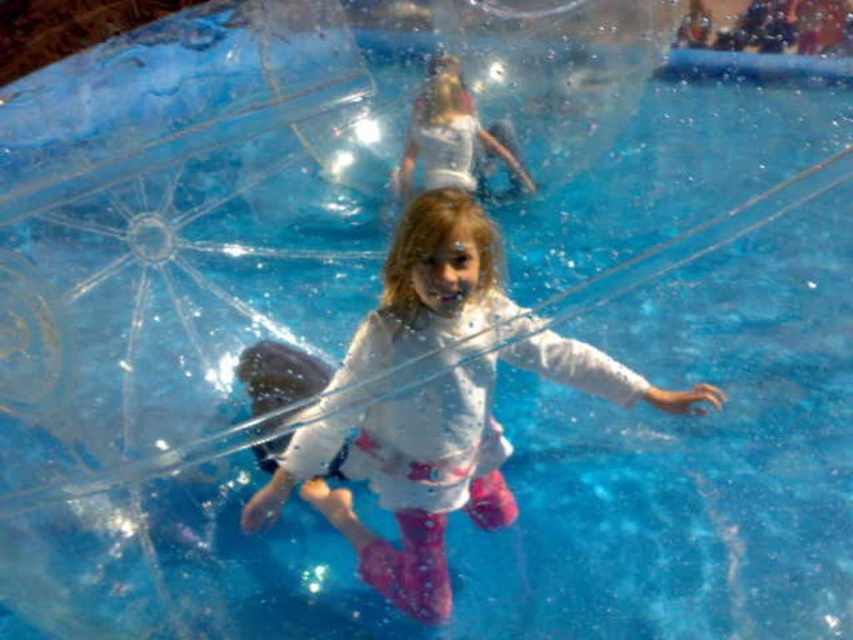
Does white matte shirt at center have a greater width compared to white cotton shirt at upper center?

Indeed, white matte shirt at center has a greater width compared to white cotton shirt at upper center.

This screenshot has height=640, width=853. What are the coordinates of `white matte shirt at center` in the screenshot? It's located at (433, 403).

Is point (422, 237) closer to camera compared to point (460, 90)?

Yes, it is.

Where is `white matte shirt at center`? white matte shirt at center is located at coordinates (433, 403).